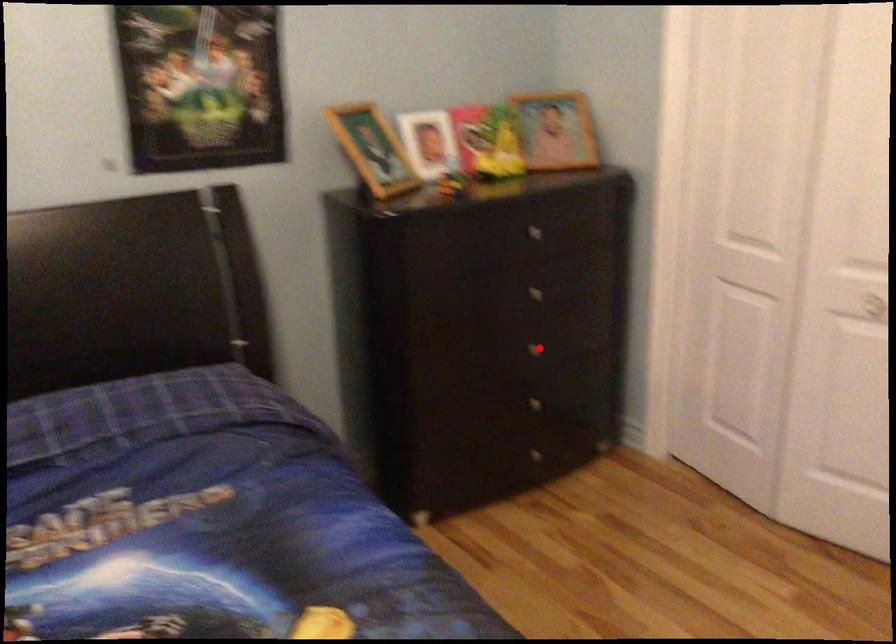
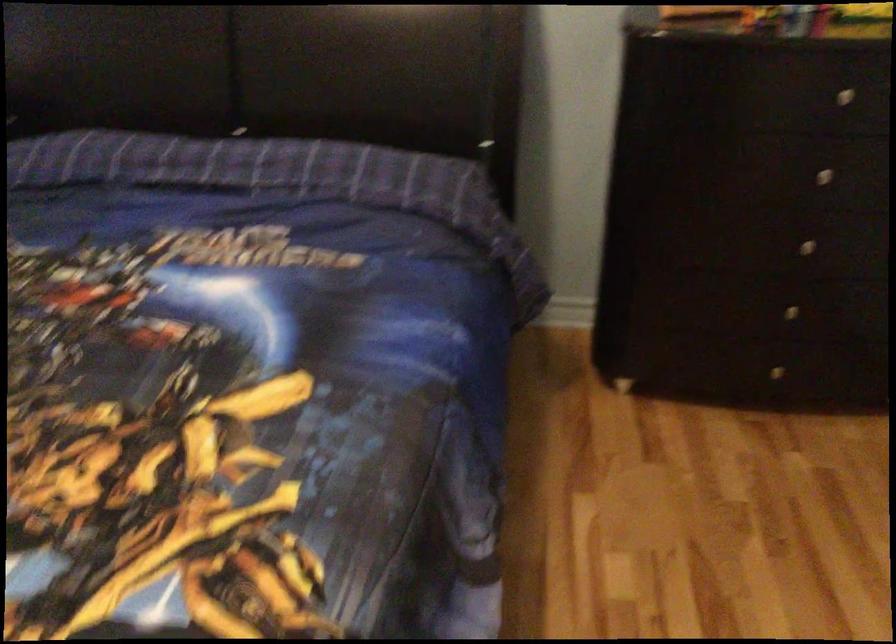
In the second image, find the point that corresponds to the highlighted location in the first image.

(805, 245)